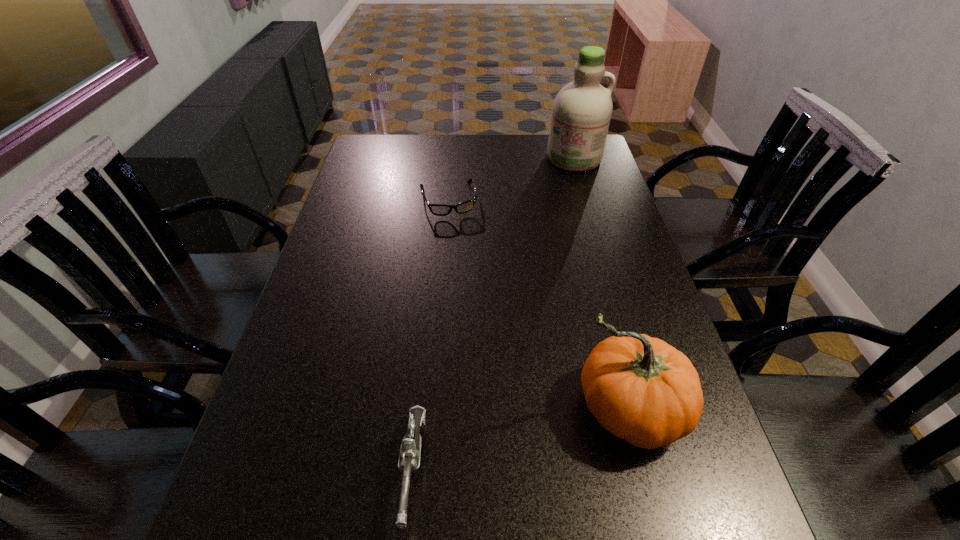
Locate an element on the screen. The image size is (960, 540). the third tallest object is located at coordinates coord(409,459).

Where is `the second tallest object`? This screenshot has width=960, height=540. the second tallest object is located at coordinates (641, 389).

Find the location of a particular element. This screenshot has height=540, width=960. cleansing agent is located at coordinates (582, 109).

The height and width of the screenshot is (540, 960). In order to click on the tallest object in this screenshot , I will do `click(582, 109)`.

Identify the location of spectacles. (437, 209).

You are a GUI agent. You are given a task and a screenshot of the screen. Output one action in this format:
    pyautogui.click(x=<x>, y=<y>)
    Task: Click on the second farthest object
    The width and height of the screenshot is (960, 540).
    Given the screenshot: What is the action you would take?
    pyautogui.click(x=437, y=209)

Locate an element on the screen. The width and height of the screenshot is (960, 540). vacant space positioned 0.300m on the left of the second tallest object is located at coordinates (421, 409).

You are a GUI agent. You are given a task and a screenshot of the screen. Output one action in this format:
    pyautogui.click(x=<x>, y=<y>)
    Task: Click on the free space located 0.140m on the front label of the cleansing agent
    
    Given the screenshot: What is the action you would take?
    pyautogui.click(x=566, y=195)

At what (x,y) coordinates should I click in order to perform the action: click on vacant space located on the front label of the cleansing agent. Please return your answer as a coordinate pair (x, y). The image size is (960, 540). Looking at the image, I should click on (560, 228).

Find the location of `vacant area situated 0.050m on the front label of the cleansing agent`. vacant area situated 0.050m on the front label of the cleansing agent is located at coordinates (569, 180).